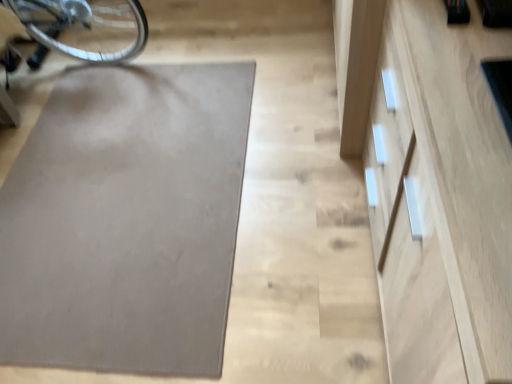
Locate an element on the screen. vacant area to the right of matte gray yoga mat at center is located at coordinates (298, 165).